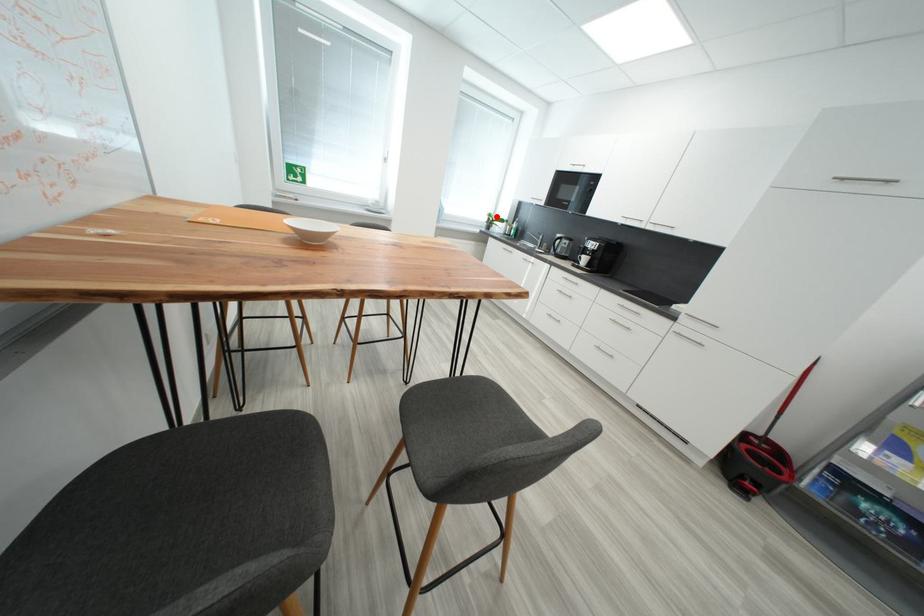
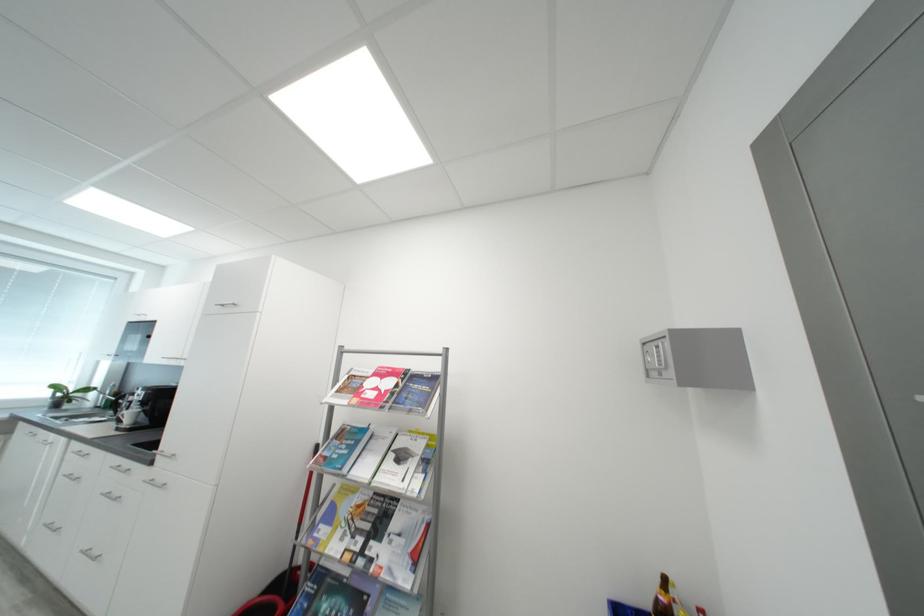
The point at the highlighted location is marked in the first image. Where is the corresponding point in the second image?

(62, 389)